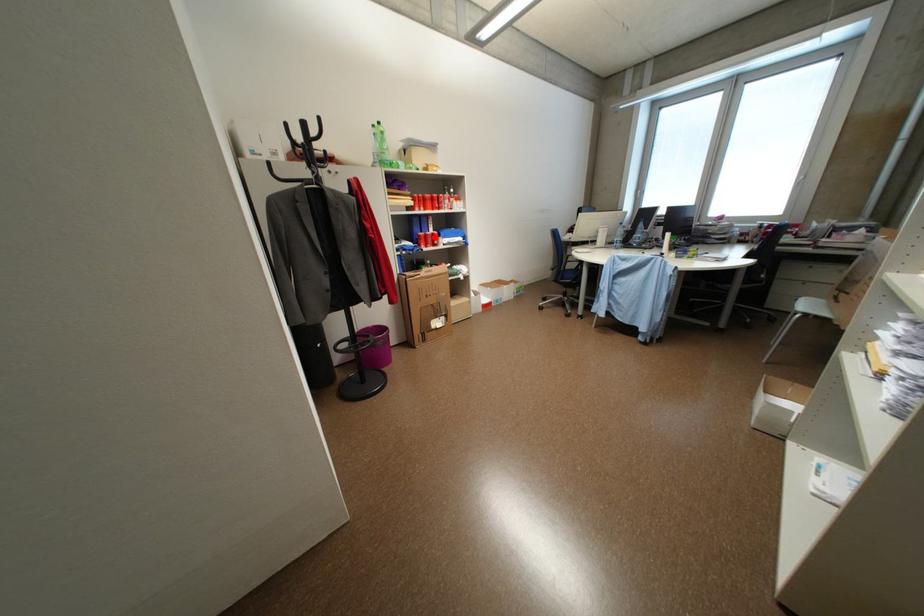
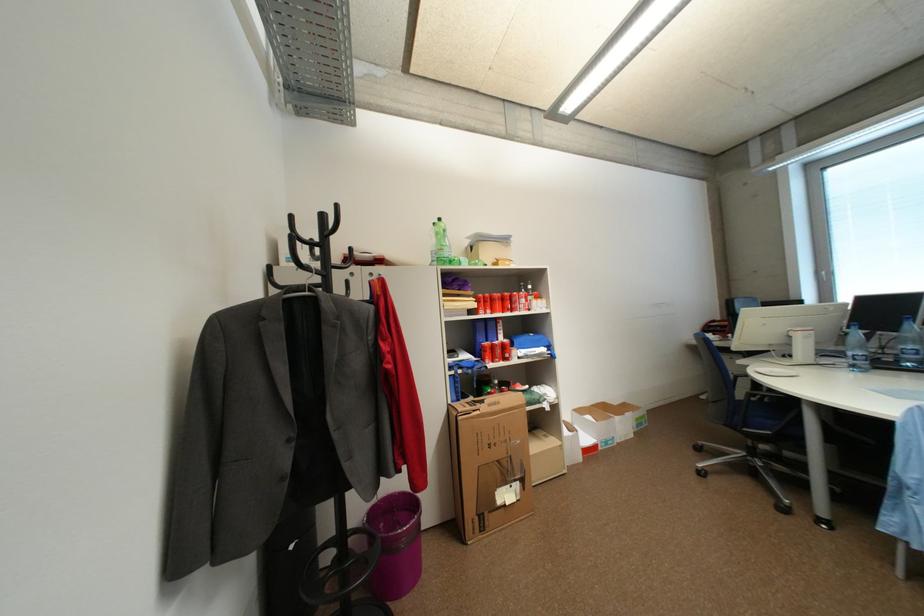
Question: A red point is marked in image1. In image2, is the corresponding 3D point closer to the camera or farther? Reply with the corresponding letter.

Choices:
 (A) The corresponding 3D point is closer.
 (B) The corresponding 3D point is farther.

Answer: (B)